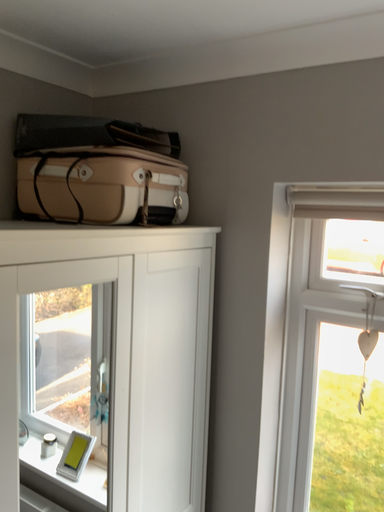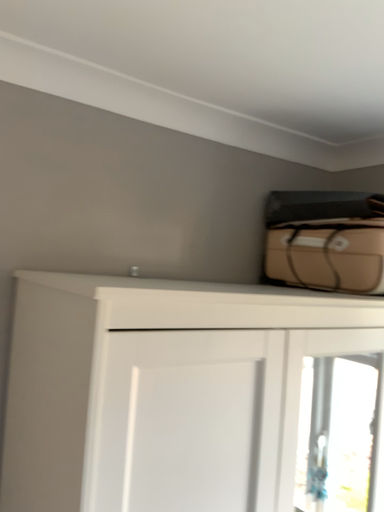
Question: How did the camera likely rotate when shooting the video?

Choices:
 (A) rotated downward
 (B) rotated upward

Answer: (B)